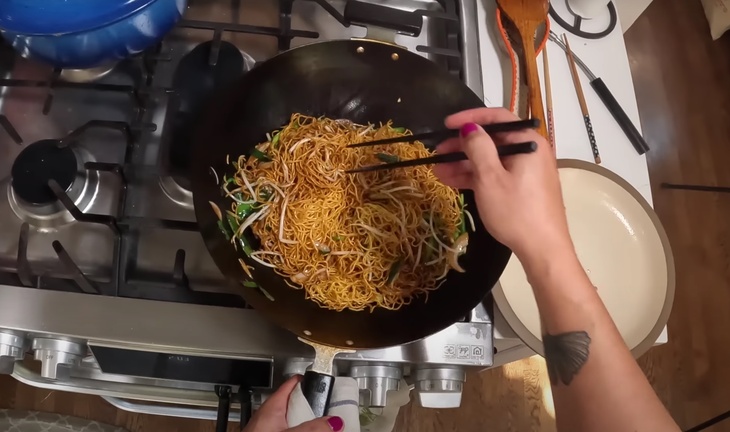
Where is `stove`? The height and width of the screenshot is (432, 730). stove is located at coordinates (120, 206).